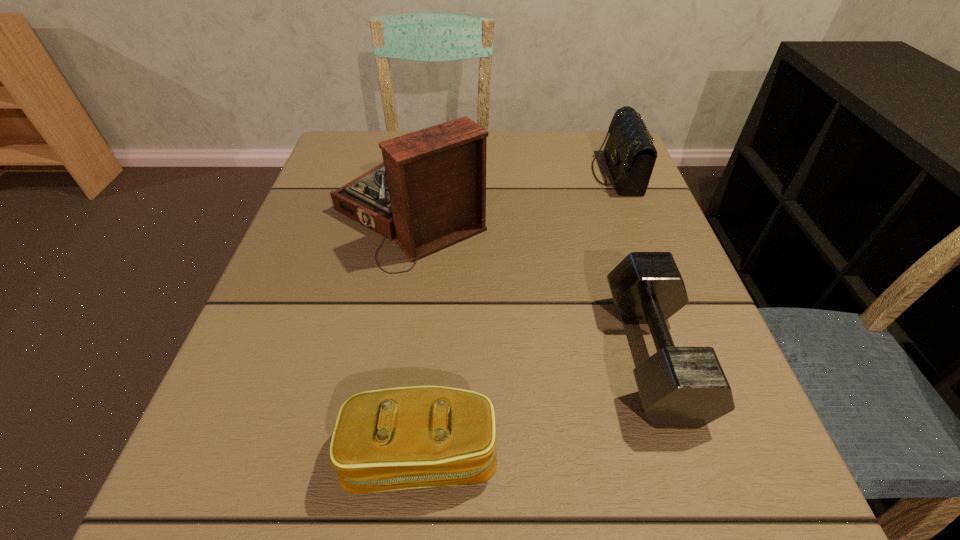
Where is `phonograph record`? This screenshot has width=960, height=540. phonograph record is located at coordinates (430, 190).

The image size is (960, 540). I want to click on the right clutch bag, so click(629, 152).

This screenshot has width=960, height=540. Find the location of `the taller clutch bag`. the taller clutch bag is located at coordinates (629, 152).

Locate an element on the screen. Image resolution: width=960 pixels, height=540 pixels. dumbbell is located at coordinates (680, 387).

I want to click on the left clutch bag, so click(400, 438).

Locate an element on the screen. The height and width of the screenshot is (540, 960). the nearer clutch bag is located at coordinates (400, 438).

I want to click on vacant space located on the right of the tallest object, so click(575, 213).

Identify the location of free space located on the front flap of the farther clutch bag. (517, 173).

The width and height of the screenshot is (960, 540). In order to click on vacant region located on the front flap of the farther clutch bag in this screenshot , I will do tap(430, 173).

At what (x,y) coordinates should I click in order to perform the action: click on free point located 0.100m on the front flap of the farther clutch bag. Please return your answer as a coordinate pair (x, y). The image size is (960, 540). Looking at the image, I should click on (549, 173).